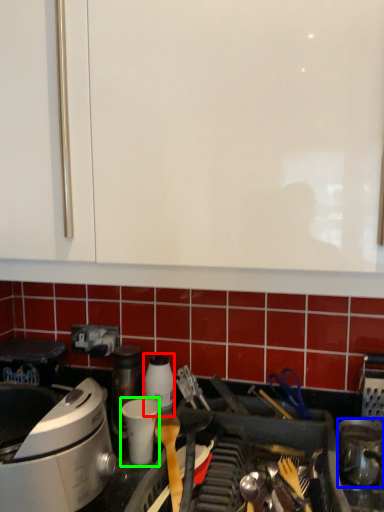
Question: Which object is positioned closest to kitchen appliance (highlighted by a red box)? Select from kitchen appliance (highlighted by a blue box) and appliance (highlighted by a green box).

Choices:
 (A) kitchen appliance
 (B) appliance

Answer: (B)